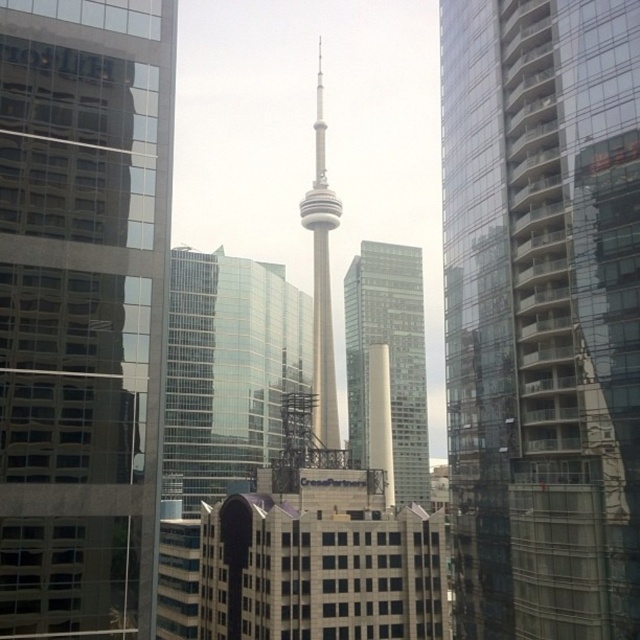
Question: Which point appears closest to the camera in this image?

Choices:
 (A) (445, 45)
 (B) (81, 124)

Answer: (B)

Question: Which of the following is the closest to the observer?

Choices:
 (A) (580, 172)
 (B) (349, 387)

Answer: (A)

Question: Can you confirm if transparent glass skyscraper at left is positioned below white glass tower at center?

Choices:
 (A) no
 (B) yes

Answer: (A)

Question: Does transparent glass skyscraper at left appear under smooth beige tower at center?

Choices:
 (A) no
 (B) yes

Answer: (B)

Question: Which object is positioned closest to the transparent glass building at center?

Choices:
 (A) transparent glass skyscraper at left
 (B) smooth beige tower at center
 (C) white glass tower at center

Answer: (A)

Question: Is transparent glass skyscraper at left in front of white glass tower at center?

Choices:
 (A) no
 (B) yes

Answer: (B)